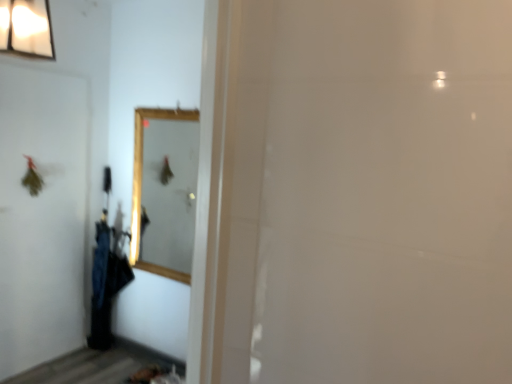
The width and height of the screenshot is (512, 384). I want to click on white matte screen door at left, so click(41, 216).

Locate an element on the screen. black fabric umbrella at left is located at coordinates (106, 282).

The width and height of the screenshot is (512, 384). What do you see at coordinates (106, 282) in the screenshot? I see `black fabric umbrella at left` at bounding box center [106, 282].

This screenshot has width=512, height=384. Find the location of `wooden framed mirror at center`. wooden framed mirror at center is located at coordinates (164, 191).

Can we say black fabric umbrella at left lies outside wooden framed mirror at center?

Yes, black fabric umbrella at left is located beyond the bounds of wooden framed mirror at center.

Looking at this image, from the image's perspective, who appears lower, black fabric umbrella at left or wooden framed mirror at center?

black fabric umbrella at left.

Are black fabric umbrella at left and wooden framed mirror at center making contact?

No, black fabric umbrella at left is not making contact with wooden framed mirror at center.

Is black fabric umbrella at left to the left or to the right of wooden framed mirror at center in the image?

black fabric umbrella at left is to the left of wooden framed mirror at center.

From the image's perspective, which one is positioned lower, black fabric umbrella at left or white matte screen door at left?

black fabric umbrella at left is shown below in the image.

Is black fabric umbrella at left closer to camera compared to white matte screen door at left?

That is False.

Based on the photo, which point is more distant from viewer, (x=98, y=349) or (x=42, y=339)?

The point (x=98, y=349) is farther from the camera.

Is white matte screen door at left with wooden framed mirror at center?

No, white matte screen door at left is not with wooden framed mirror at center.

From the image's perspective, is white matte screen door at left located beneath wooden framed mirror at center?

Correct, white matte screen door at left appears lower than wooden framed mirror at center in the image.

Consider the image. Which point is more forward, (86,175) or (138,146)?

Positioned in front is point (138,146).

Between wooden framed mirror at center and white matte screen door at left, which one appears on the left side from the viewer's perspective?

From the viewer's perspective, white matte screen door at left appears more on the left side.

Between wooden framed mirror at center and white matte screen door at left, which one has smaller width?

With smaller width is white matte screen door at left.

Measure the distance from wooden framed mirror at center to white matte screen door at left.

They are 34.63 inches apart.

Is white matte screen door at left a part of wooden framed mirror at center?

Definitely not — white matte screen door at left is not inside wooden framed mirror at center.

The image size is (512, 384). I want to click on mirror that is on the right side of black fabric umbrella at left, so click(164, 191).

Considering the positions of objects wooden framed mirror at center and black fabric umbrella at left in the image provided, who is more to the right, wooden framed mirror at center or black fabric umbrella at left?

Positioned to the right is wooden framed mirror at center.

Is wooden framed mirror at center bigger than black fabric umbrella at left?

Incorrect, wooden framed mirror at center is not larger than black fabric umbrella at left.

Based on the photo, which of these two, wooden framed mirror at center or black fabric umbrella at left, stands taller?

Standing taller between the two is black fabric umbrella at left.

Can you tell me how much white matte screen door at left and black fabric umbrella at left differ in facing direction?

white matte screen door at left and black fabric umbrella at left are facing 87.4 degrees away from each other.

Between white matte screen door at left and black fabric umbrella at left, which one is positioned in front?

white matte screen door at left is more forward.

From a real-world perspective, which is physically below, white matte screen door at left or black fabric umbrella at left?

In real-world perspective, black fabric umbrella at left is lower.

In terms of height, does white matte screen door at left look taller or shorter compared to black fabric umbrella at left?

In the image, white matte screen door at left appears to be taller than black fabric umbrella at left.

I want to click on laundry that is behind the wooden framed mirror at center, so click(106, 282).

The width and height of the screenshot is (512, 384). In order to click on laundry below the white matte screen door at left (from a real-world perspective) in this screenshot , I will do `click(106, 282)`.

From the image, which object appears to be farther from wooden framed mirror at center, black fabric umbrella at left or white matte screen door at left?

white matte screen door at left is positioned further to the anchor wooden framed mirror at center.

Looking at the image, which one is located closer to black fabric umbrella at left, wooden framed mirror at center or white matte screen door at left?

white matte screen door at left.

When comparing their distances from wooden framed mirror at center, does white matte screen door at left or black fabric umbrella at left seem closer?

black fabric umbrella at left is closer to wooden framed mirror at center.

Estimate the real-world distances between objects in this image. Which object is further from white matte screen door at left, black fabric umbrella at left or wooden framed mirror at center?

wooden framed mirror at center is positioned further to the anchor white matte screen door at left.

Considering their positions, is white matte screen door at left positioned closer to black fabric umbrella at left than wooden framed mirror at center?

The object closer to black fabric umbrella at left is white matte screen door at left.

Which object lies nearer to the anchor point white matte screen door at left, wooden framed mirror at center or black fabric umbrella at left?

black fabric umbrella at left is positioned closer to the anchor white matte screen door at left.

At what (x,y) coordinates should I click in order to perform the action: click on laundry between white matte screen door at left and wooden framed mirror at center in the horizontal direction. Please return your answer as a coordinate pair (x, y). The image size is (512, 384). Looking at the image, I should click on tap(106, 282).